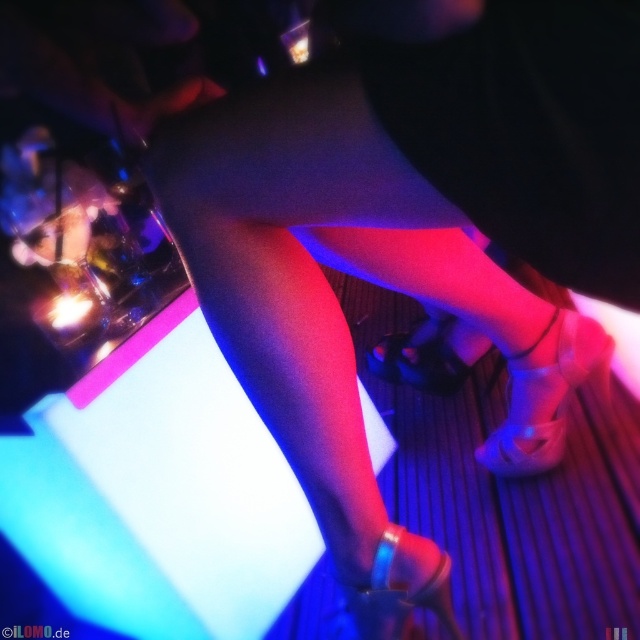
You are at a nightclub and want to place a small decorative item exactly where the clear plastic ring at lower center is located. What are the coordinates of that location?

The coordinates of the clear plastic ring at lower center are at point (401, 589).

You are a stagehand setting up for a performance. You need to place a decorative item between the clear plastic ring at lower center and the satin black shoe at center. Considering their widths, which object should you place closer to the narrower one to maintain balance?

The clear plastic ring at lower center has a lesser width compared to the satin black shoe at center, so you should place the decorative item closer to the clear plastic ring at lower center to maintain balance.

You are a dancer at the nightclub and you need to place your clear plastic shoe at lower right on a shelf that is 3 feet wide. Will it fit?

The clear plastic shoe at lower right is 39.07 inches in length. Since 3 feet equals 36 inches, the shoe is longer than the shelf, so it won not fit.